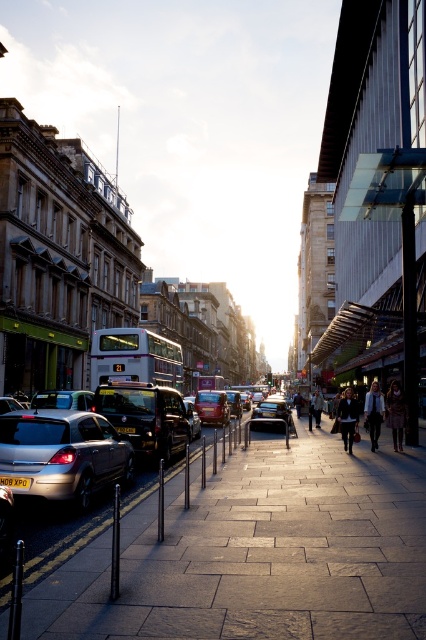
Is dark gray casual wear at center further to the viewer compared to dark brown leather jacket at center?

Yes, dark gray casual wear at center is further from the viewer.

Does point (374, 449) come behind point (391, 424)?

No.

I want to click on dark gray casual wear at center, so click(x=385, y=413).

Identify the location of dark gray casual wear at center. (385, 413).

Can you confirm if black glossy car at center is shorter than white textured coat at center?

No.

Is black glossy car at center thinner than white textured coat at center?

Incorrect, black glossy car at center's width is not less than white textured coat at center's.

This screenshot has width=426, height=640. I want to click on black glossy car at center, so click(x=146, y=417).

Does silver metallic hatchback at center appear under satin silver sedan at lower left?

Actually, silver metallic hatchback at center is above satin silver sedan at lower left.

Can you confirm if silver metallic hatchback at center is positioned to the right of satin silver sedan at lower left?

No, silver metallic hatchback at center is not to the right of satin silver sedan at lower left.

At what (x,y) coordinates should I click in order to perform the action: click on silver metallic hatchback at center. Please return your answer as a coordinate pair (x, y). Image resolution: width=426 pixels, height=640 pixels. Looking at the image, I should click on (85, 442).